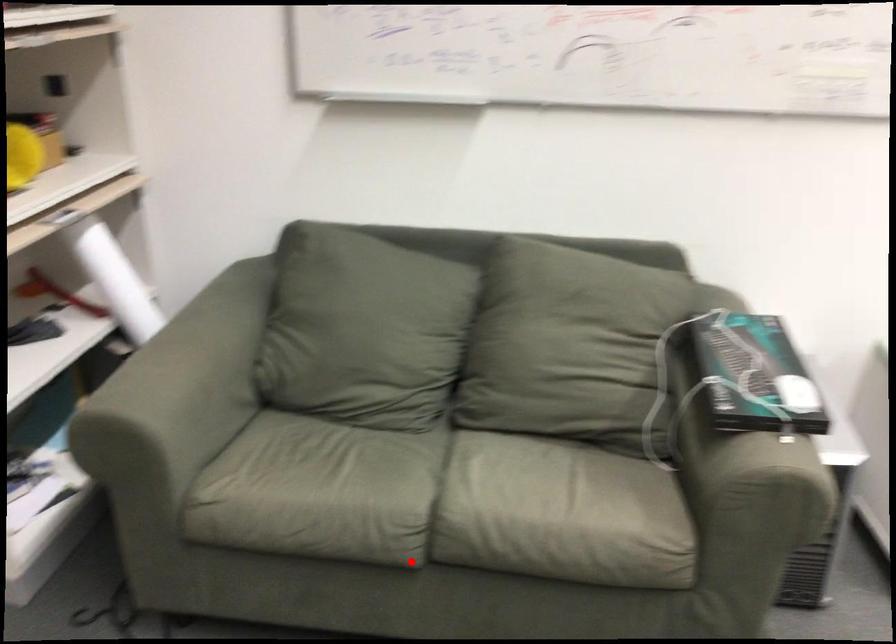
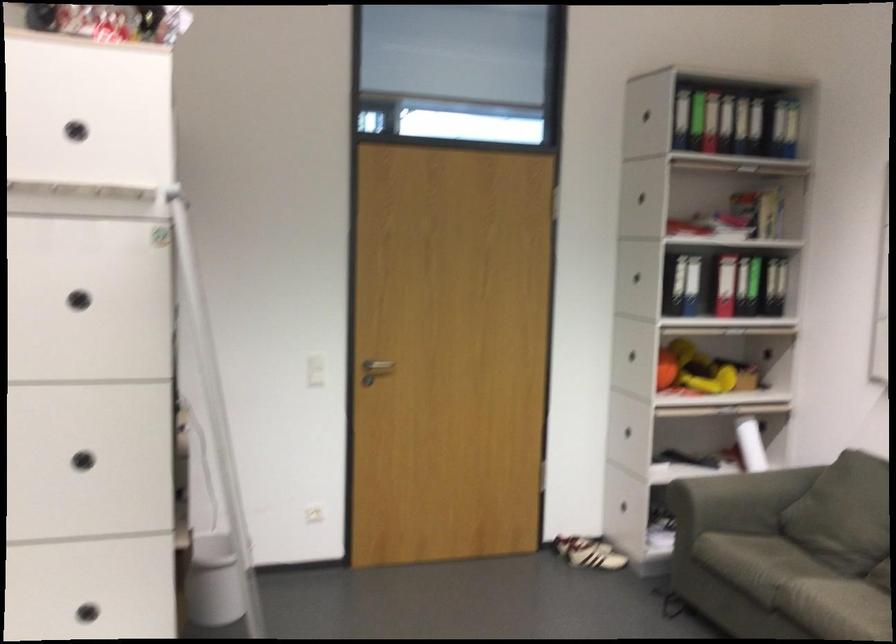
Question: I am providing you with two images of the same scene from different viewpoints. In image1, a red point is highlighted. Considering the same 3D point in image2, which of the following is correct?

Choices:
 (A) It is closer
 (B) It is farther

Answer: (B)